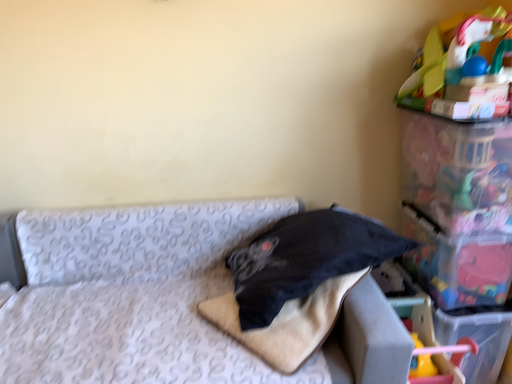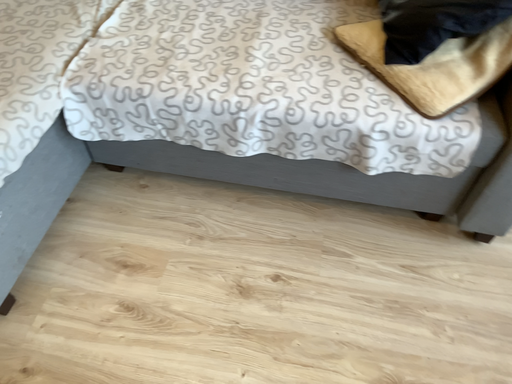
Question: Which way did the camera rotate in the video?

Choices:
 (A) rotated left
 (B) rotated right

Answer: (A)